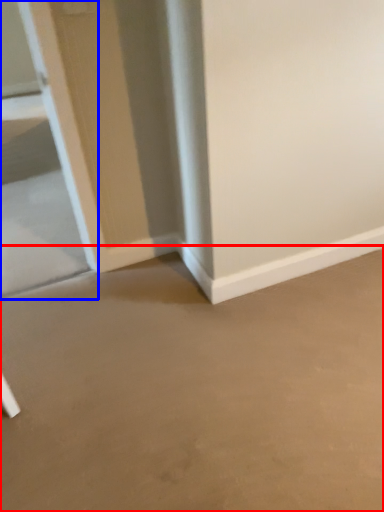
Question: Among these objects, which one is farthest to the camera, concrete (highlighted by a red box) or glass door (highlighted by a blue box)?

Choices:
 (A) concrete
 (B) glass door

Answer: (B)